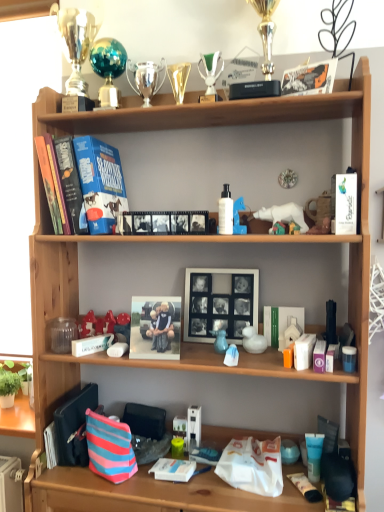
Question: From their relative heights in the image, would you say white matte paperback book at upper right, the second paperback book in the back-to-front sequence, is taller or shorter than matte plastic tube at lower right, which ranks as the 2th toiletry in left-to-right order?

Choices:
 (A) tall
 (B) short

Answer: (A)

Question: Relative to matte plastic tube at lower right, which ranks as the 2th toiletry in left-to-right order, is white matte paperback book at upper right, the second paperback book in the back-to-front sequence, in front or behind?

Choices:
 (A) behind
 (B) front

Answer: (B)

Question: Which object is the farthest from the white matte book at center, positioned as the second book in bottom-to-top order?

Choices:
 (A) striped fabric pouch at lower left
 (B) white plastic duck at center, which appears as the 1th toy when ordered from the bottom
 (C) matte brown figurine at upper right, arranged as the first toy when viewed from the right
 (D) shiny teal sphere at upper center, the 8th toy when ordered from bottom to top
 (E) white glossy lotion at center, which is counted as the first toiletry, starting from the top

Answer: (D)

Question: Estimate the real-world distances between objects in this image. Which object is closer to the white matte picture frame at center?

Choices:
 (A) purple matte tube at middle right, acting as the second toiletry starting from the right
 (B) shiny red plastic toy at center, arranged as the 8th toy when viewed from the right
 (C) matte blue rubber duck at middle, which is the 2th toy in bottom-to-top order
 (D) gold metallic trophy at upper center, which is counted as the third toy, starting from the left
 (E) white plastic duck at center, positioned as the eighth toy in top-to-bottom order

Answer: (C)